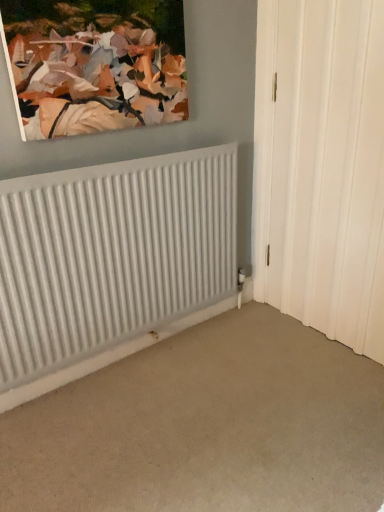
Question: From the image's perspective, is matte canvas painting at upper left positioned above or below white ribbed radiator at lower left?

Choices:
 (A) above
 (B) below

Answer: (A)

Question: In terms of size, does matte canvas painting at upper left appear bigger or smaller than white ribbed radiator at lower left?

Choices:
 (A) big
 (B) small

Answer: (B)

Question: Which object is the closest to the white textured door at right?

Choices:
 (A) matte canvas painting at upper left
 (B) white ribbed radiator at lower left

Answer: (B)

Question: Which is farther from the white textured door at right?

Choices:
 (A) matte canvas painting at upper left
 (B) white ribbed radiator at lower left

Answer: (A)